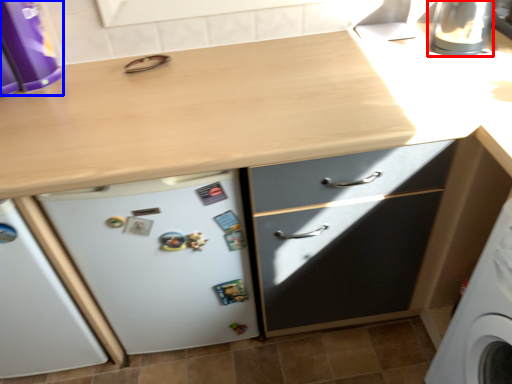
Question: Which of the following is the farthest to the observer, appliance (highlighted by a red box) or kitchen appliance (highlighted by a blue box)?

Choices:
 (A) appliance
 (B) kitchen appliance

Answer: (A)